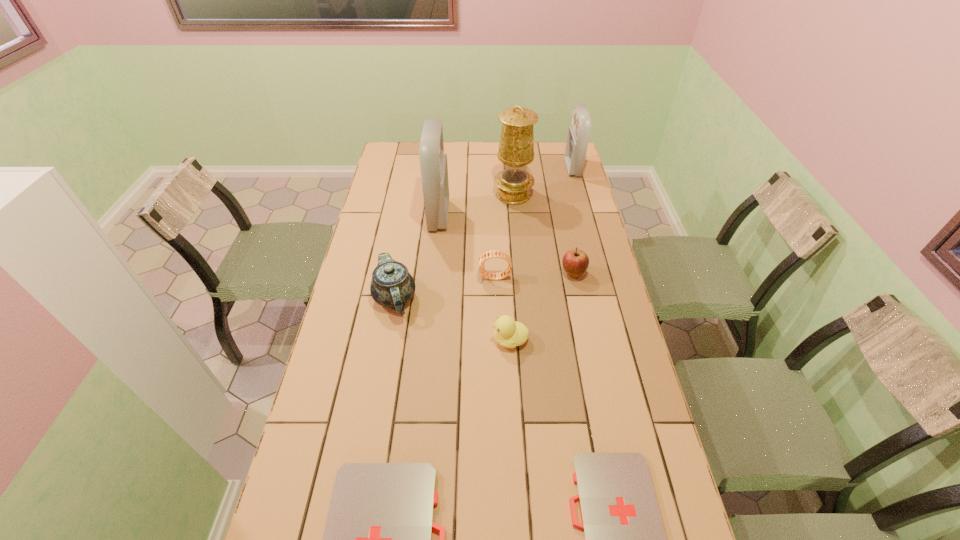
The height and width of the screenshot is (540, 960). I want to click on vacant space located 0.280m at the beak of the seventh tallest object, so click(401, 340).

Where is `vacant space located at the beak of the seventh tallest object`? The height and width of the screenshot is (540, 960). vacant space located at the beak of the seventh tallest object is located at coordinates (401, 340).

Locate an element on the screen. This screenshot has height=540, width=960. vacant space located at the beak of the seventh tallest object is located at coordinates (382, 340).

Image resolution: width=960 pixels, height=540 pixels. Find the location of `object present at the far edge`. object present at the far edge is located at coordinates (578, 133).

In order to click on object that is at the left edge in this screenshot , I will do `click(392, 286)`.

Locate an element on the screen. The height and width of the screenshot is (540, 960). the first-aid kit at the right edge is located at coordinates (578, 133).

You are a GUI agent. You are given a task and a screenshot of the screen. Output one action in this format:
    pyautogui.click(x=<x>, y=<y>)
    Task: Click on the apple present at the right edge
    The image size is (960, 540).
    Given the screenshot: What is the action you would take?
    pyautogui.click(x=575, y=262)

Where is `object present at the far right corner`? object present at the far right corner is located at coordinates (578, 133).

Identify the location of vacant space at the far edge of the desktop. (464, 154).

Where is `vacant space at the left edge`? Image resolution: width=960 pixels, height=540 pixels. vacant space at the left edge is located at coordinates (348, 401).